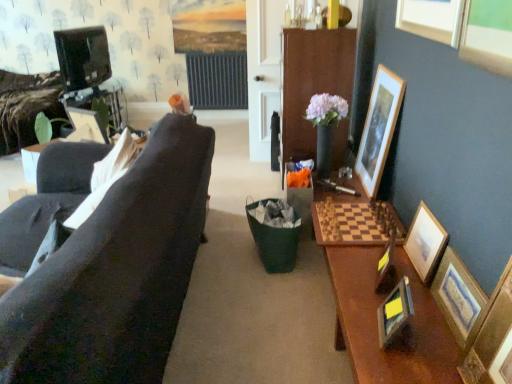
Locate an element on the screen. This screenshot has height=384, width=512. wooden cabinet at center is located at coordinates (312, 82).

Where is `wooden picture frame at right, the 5th picture frame from the left`? Image resolution: width=512 pixels, height=384 pixels. wooden picture frame at right, the 5th picture frame from the left is located at coordinates (379, 128).

Locate an element on the screen. The height and width of the screenshot is (384, 512). wooden picture frame at right, arranged as the 2th picture frame when viewed from the right is located at coordinates (425, 243).

Where is `black glossy television at upper left`? This screenshot has width=512, height=384. black glossy television at upper left is located at coordinates (83, 57).

In order to face wooden framed picture at right, the 1th picture frame viewed from the right, should I rotate leftwards or rightwards?

Turn right approximately 25.375 degrees to face it.

Find the location of `wooden framed picture at right, the 1th picture frame viewed from the right`. wooden framed picture at right, the 1th picture frame viewed from the right is located at coordinates (458, 297).

Describe the element at coordinates (386, 267) in the screenshot. I see `wooden picture frame at lower right, the fifth picture frame when ordered from right to left` at that location.

The height and width of the screenshot is (384, 512). Find the location of `wooden cabinet at center`. wooden cabinet at center is located at coordinates (312, 82).

Considering the relative positions of wooden cabinet at center and wooden picture frame at right, which is the fourth picture frame from left to right, in the image provided, is wooden cabinet at center to the left of wooden picture frame at right, which is the fourth picture frame from left to right, from the viewer's perspective?

Correct, you'll find wooden cabinet at center to the left of wooden picture frame at right, which is the fourth picture frame from left to right.

Which object is thinner, wooden cabinet at center or wooden picture frame at right, which is the fourth picture frame from left to right?

wooden picture frame at right, which is the fourth picture frame from left to right.

How different are the orientations of wooden cabinet at center and wooden picture frame at right, arranged as the fourth picture frame when viewed from the right, in degrees?

There is a 0.812-degree angle between the facing directions of wooden cabinet at center and wooden picture frame at right, arranged as the fourth picture frame when viewed from the right.

Is point (295, 158) closer to camera compared to point (504, 289)?

No, it is not.

Locate an element on the screen. the 3rd picture frame in front of the black glossy television at upper left is located at coordinates (386, 267).

Is wooden picture frame at lower right, the fifth picture frame when ordered from right to left, taller or shorter than black glossy television at upper left?

In the image, wooden picture frame at lower right, the fifth picture frame when ordered from right to left, appears to be shorter than black glossy television at upper left.

Is wooden picture frame at lower right, which is the third picture frame from left to right, facing towards black glossy television at upper left?

No, wooden picture frame at lower right, which is the third picture frame from left to right, does not turn towards black glossy television at upper left.

Is wooden picture frame at lower right, which is counted as the 6th picture frame, starting from the right, facing towards wooden picture frame at right, the 5th picture frame from the left?

No.

From a real-world perspective, between wooden picture frame at lower right, which is the 2th picture frame in left-to-right order, and wooden picture frame at right, the 3th picture frame from the right, who is vertically lower?

From a 3D spatial view, wooden picture frame at lower right, which is the 2th picture frame in left-to-right order, is below.

In the image, is wooden picture frame at lower right, which is the 2th picture frame in left-to-right order, positioned in front of or behind wooden picture frame at right, the 5th picture frame from the left?

wooden picture frame at lower right, which is the 2th picture frame in left-to-right order, is in front of wooden picture frame at right, the 5th picture frame from the left.

Would you say wooden picture frame at right, the 5th picture frame from the left, is part of wooden picture frame at lower right, which is the 2th picture frame in left-to-right order,'s contents?

No, wooden picture frame at right, the 5th picture frame from the left, is not a part of wooden picture frame at lower right, which is the 2th picture frame in left-to-right order.

Is point (80, 125) positioned before point (83, 39)?

Yes, it is.

From the image's perspective, relative to black glossy television at upper left, is wooden picture frame at left, which is counted as the first picture frame, starting from the left, above or below?

wooden picture frame at left, which is counted as the first picture frame, starting from the left, is situated lower than black glossy television at upper left in the image.

Looking at this image, is there a large distance between wooden picture frame at left, which is counted as the first picture frame, starting from the left, and black glossy television at upper left?

wooden picture frame at left, which is counted as the first picture frame, starting from the left, is far away from black glossy television at upper left.

Identify the location of television that is on the left side of wooden picture frame at left, which is counted as the first picture frame, starting from the left. The height and width of the screenshot is (384, 512). (83, 57).

Could you measure the distance between wooden framed picture at right, placed as the 7th picture frame when sorted from left to right, and wooden picture frame at lower right, which is the 2th picture frame in left-to-right order?

8.44 inches.

Considering the positions of points (452, 249) and (394, 290), is point (452, 249) closer to camera compared to point (394, 290)?

Yes, point (452, 249) is in front of point (394, 290).

From a real-world perspective, is wooden framed picture at right, the 1th picture frame viewed from the right, above or below wooden picture frame at lower right, which is the 2th picture frame in left-to-right order?

In terms of real-world spatial position, wooden framed picture at right, the 1th picture frame viewed from the right, is above wooden picture frame at lower right, which is the 2th picture frame in left-to-right order.

Visually, is wooden picture frame at right, arranged as the 2th picture frame when viewed from the right, positioned to the left or to the right of wooden framed picture at right, the 1th picture frame viewed from the right?

In the image, wooden picture frame at right, arranged as the 2th picture frame when viewed from the right, appears on the left side of wooden framed picture at right, the 1th picture frame viewed from the right.

Considering the points (408, 246) and (454, 313), which point is in front, point (408, 246) or point (454, 313)?

The point (454, 313) is closer to the camera.

Which object is further away from the camera taking this photo, wooden picture frame at right, arranged as the 2th picture frame when viewed from the right, or wooden framed picture at right, placed as the 7th picture frame when sorted from left to right?

wooden picture frame at right, arranged as the 2th picture frame when viewed from the right, is more distant.

Is wooden picture frame at right, placed as the 6th picture frame when sorted from left to right, oriented away from wooden framed picture at right, placed as the 7th picture frame when sorted from left to right?

No, wooden picture frame at right, placed as the 6th picture frame when sorted from left to right, is not facing the opposite direction of wooden framed picture at right, placed as the 7th picture frame when sorted from left to right.

In the image, is black glossy television at upper left on the left side or the right side of wooden picture frame at right, arranged as the fourth picture frame when viewed from the right?

black glossy television at upper left is to the left of wooden picture frame at right, arranged as the fourth picture frame when viewed from the right.

From the picture: Can you see black glossy television at upper left touching wooden picture frame at right, which is the fourth picture frame from left to right?

No.

Can you confirm if black glossy television at upper left is taller than wooden picture frame at right, which is the fourth picture frame from left to right?

Indeed, black glossy television at upper left has a greater height compared to wooden picture frame at right, which is the fourth picture frame from left to right.

Is black glossy television at upper left facing away from wooden picture frame at right, which is the fourth picture frame from left to right?

No.

Locate an element on the screen. cabinetry behind the wooden picture frame at right, which is the fourth picture frame from left to right is located at coordinates (312, 82).

Identify the location of the 3rd picture frame in front of the black glossy television at upper left. (386, 267).

Based on the photo, based on their spatial positions, is wooden picture frame at right, arranged as the 2th picture frame when viewed from the right, or wooden picture frame at lower right, which is the 2th picture frame in left-to-right order, further from wooden cabinet at center?

wooden picture frame at lower right, which is the 2th picture frame in left-to-right order, lies further to wooden cabinet at center than the other object.

Based on their spatial positions, is wooden picture frame at left, which is counted as the first picture frame, starting from the left, or black glossy television at upper left further from wooden picture frame at right, placed as the 6th picture frame when sorted from left to right?

black glossy television at upper left is further to wooden picture frame at right, placed as the 6th picture frame when sorted from left to right.

Estimate the real-world distances between objects in this image. Which object is closer to wooden cabinet at center, wooden picture frame at right, the 5th picture frame from the left, or wooden picture frame at right, arranged as the 2th picture frame when viewed from the right?

wooden picture frame at right, the 5th picture frame from the left.

When comparing their distances from wooden cabinet at center, does wooden picture frame at lower right, which is the third picture frame from left to right, or wooden picture frame at left, the seventh picture frame positioned from the right, seem closer?

wooden picture frame at lower right, which is the third picture frame from left to right, is closer to wooden cabinet at center.

From the image, which object appears to be nearer to wooden cabinet at center, wooden picture frame at right, placed as the 6th picture frame when sorted from left to right, or wooden picture frame at right, the 3th picture frame from the right?

Based on the image, wooden picture frame at right, the 3th picture frame from the right, appears to be nearer to wooden cabinet at center.

Looking at the image, which one is located closer to wooden framed picture at right, the 1th picture frame viewed from the right, wooden picture frame at lower right, which is the 2th picture frame in left-to-right order, or wooden cabinet at center?

Based on the image, wooden picture frame at lower right, which is the 2th picture frame in left-to-right order, appears to be nearer to wooden framed picture at right, the 1th picture frame viewed from the right.

Considering their positions, is wooden framed picture at right, placed as the 7th picture frame when sorted from left to right, positioned closer to wooden picture frame at right, arranged as the fourth picture frame when viewed from the right, than wooden picture frame at lower right, which is the 2th picture frame in left-to-right order?

wooden framed picture at right, placed as the 7th picture frame when sorted from left to right, is positioned closer to the anchor wooden picture frame at right, arranged as the fourth picture frame when viewed from the right.

Looking at the image, which one is located closer to wooden framed picture at right, placed as the 7th picture frame when sorted from left to right, wooden picture frame at right, which is the fourth picture frame from left to right, or wooden cabinet at center?

wooden picture frame at right, which is the fourth picture frame from left to right, lies closer to wooden framed picture at right, placed as the 7th picture frame when sorted from left to right, than the other object.

Locate an element on the screen. This screenshot has height=384, width=512. cabinetry between black glossy television at upper left and wooden picture frame at lower right, which is counted as the 6th picture frame, starting from the right is located at coordinates (312, 82).

Find the location of `picture frame between wooden picture frame at right, which is the fourth picture frame from left to right, and wooden picture frame at lower right, which is the 2th picture frame in left-to-right order, along the z-axis`. picture frame between wooden picture frame at right, which is the fourth picture frame from left to right, and wooden picture frame at lower right, which is the 2th picture frame in left-to-right order, along the z-axis is located at coordinates (458, 297).

In order to click on cabinetry between wooden picture frame at left, the seventh picture frame positioned from the right, and wooden picture frame at right, arranged as the fourth picture frame when viewed from the right, in the horizontal direction in this screenshot , I will do `click(312, 82)`.

At what (x,y) coordinates should I click in order to perform the action: click on cabinetry between wooden picture frame at left, which is counted as the first picture frame, starting from the left, and wooden framed picture at right, the 1th picture frame viewed from the right, in the horizontal direction. Please return your answer as a coordinate pair (x, y). The image size is (512, 384). Looking at the image, I should click on (312, 82).